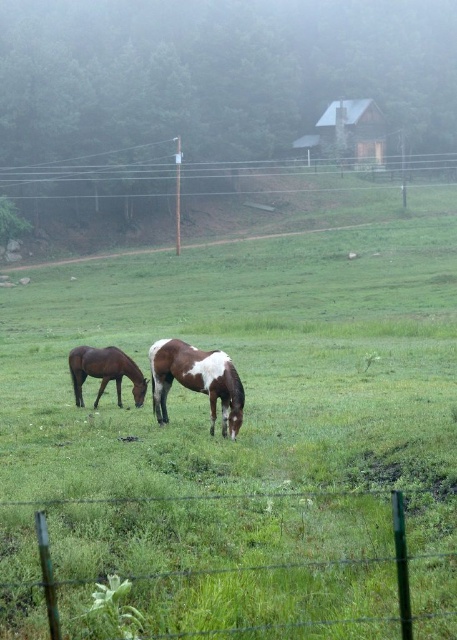
Question: Which of the following is the farthest from the observer?

Choices:
 (A) (44, 554)
 (B) (161, 352)
 (C) (86, 372)

Answer: (C)

Question: Can you confirm if green wire fence at lower center is positioned above brown glossy horse at center?

Choices:
 (A) no
 (B) yes

Answer: (A)

Question: From the image, what is the correct spatial relationship of brown glossy horse at center in relation to brown glossy horse at left?

Choices:
 (A) right
 (B) left

Answer: (A)

Question: Which object is closer to the camera taking this photo?

Choices:
 (A) brown glossy horse at center
 (B) brown glossy horse at left

Answer: (A)

Question: Which point is farther from the camera taking this photo?

Choices:
 (A) (175, 362)
 (B) (361, 618)

Answer: (A)

Question: Where is green wire fence at lower center located in relation to brown glossy horse at left in the image?

Choices:
 (A) left
 (B) right

Answer: (B)